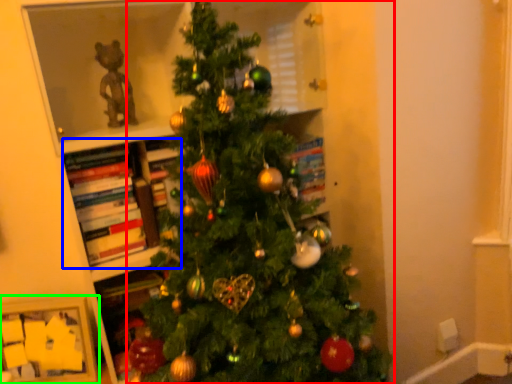
Question: Estimate the real-world distances between objects in this image. Which object is farther from christmas tree (highlighted by a red box), book (highlighted by a blue box) or picture frame (highlighted by a green box)?

Choices:
 (A) book
 (B) picture frame

Answer: (B)